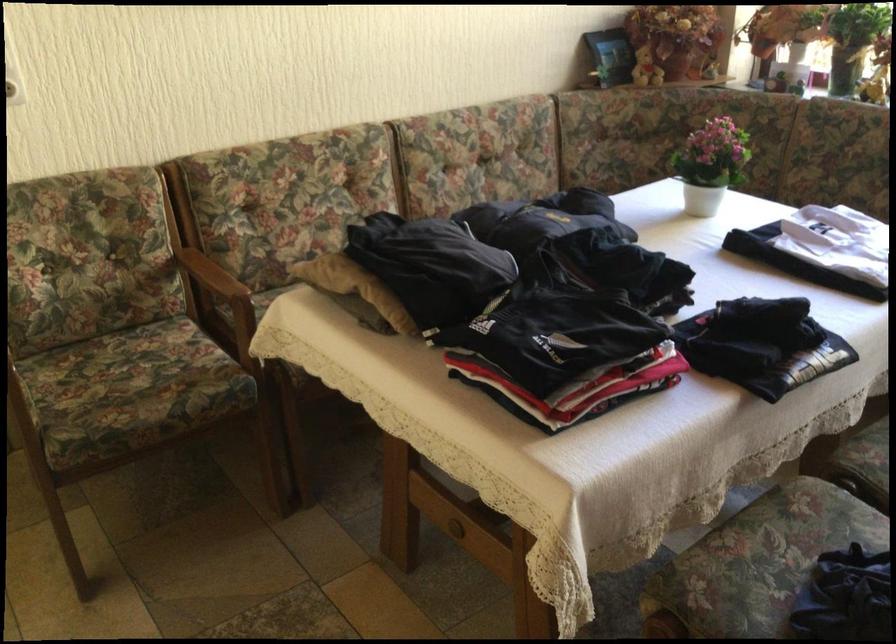
This screenshot has height=644, width=896. In order to click on chair sitting surface in this screenshot , I will do (x=130, y=383).